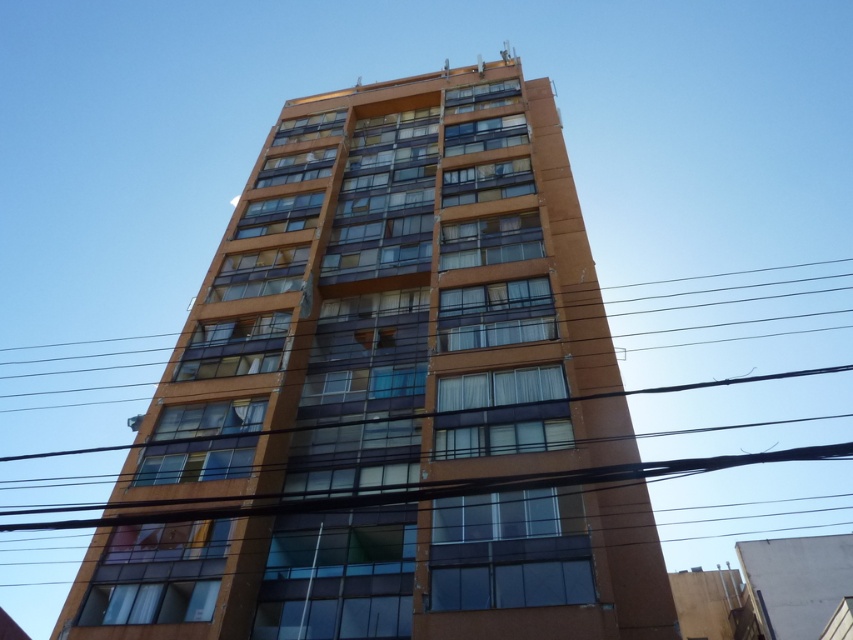
You are an urban planner reviewing this area. You need to determine if the orange glass building at center will block the view of the transparent glass power lines at center from a pedestrian standing directly in front of the building. Based on the spatial relationship between them, what is your assessment?

The orange glass building at center is closer to the viewer than the transparent glass power lines at center, so the building will block the view of the power lines from a pedestrian standing directly in front of it.

You are an urban planner analyzing the image. You need to determine which structure occupies more visual space in the scene between the orange glass building at center and the transparent glass power lines at center. Based on the provided information, which one is larger?

The orange glass building at center is smaller than the transparent glass power lines at center, so the transparent glass power lines at center occupy more visual space in the scene.

You are an urban planner analyzing the image of the cityscape. You notice the orange glass building at center and the transparent glass power lines at center. Which of these two objects has a smaller width?

The orange glass building at center has a lesser width compared to the transparent glass power lines at center, so the orange glass building at center is narrower.